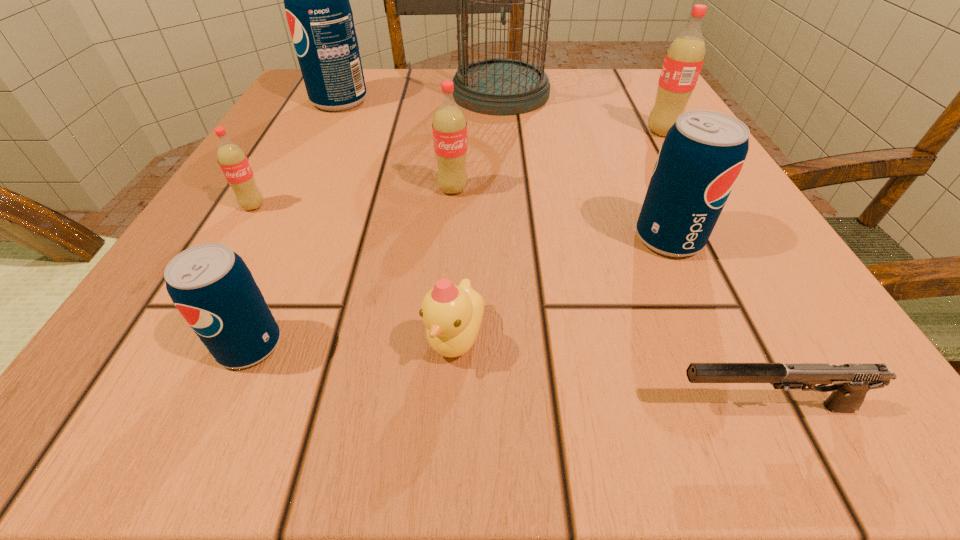
Find the location of a particular element. the closest blue pop to the tallest object is located at coordinates (319, 15).

You are a GUI agent. You are given a task and a screenshot of the screen. Output one action in this format:
    pyautogui.click(x=<x>, y=<y>)
    Task: Click on the red soda that is the third closest to the nearest blue pop
    The height and width of the screenshot is (540, 960).
    Given the screenshot: What is the action you would take?
    pyautogui.click(x=684, y=59)

Identify which red soda is the second closest to the gun. Please provide its 2D coordinates. Your answer should be formatted as a tuple, i.e. [(x, y)], where the tuple contains the x and y coordinates of a point satisfying the conditions above.

[(684, 59)]

The image size is (960, 540). I want to click on vacant space that satisfies the following two spatial constraints: 1. on the back side of the nearest soda; 2. on the right side of the seventh nearest object, so click(x=343, y=132).

Where is `vacant area that satisfies the following two spatial constraints: 1. on the front-facing side of the tallest object; 2. on the front side of the second red soda from right to left`? The width and height of the screenshot is (960, 540). vacant area that satisfies the following two spatial constraints: 1. on the front-facing side of the tallest object; 2. on the front side of the second red soda from right to left is located at coordinates (508, 189).

Find the location of `vacant space that satisfies the following two spatial constraints: 1. on the front-facing side of the biggest red soda; 2. on the right side of the tallest object`. vacant space that satisfies the following two spatial constraints: 1. on the front-facing side of the biggest red soda; 2. on the right side of the tallest object is located at coordinates (503, 132).